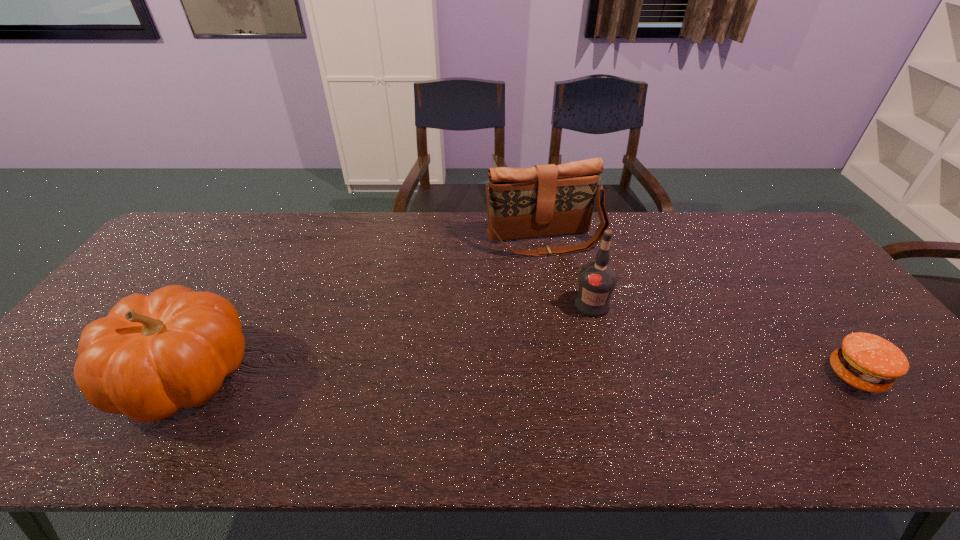
Identify the location of vacant space located 0.220m on the front label of the second farthest object. The image size is (960, 540). (624, 387).

Where is `free spot located on the front label of the second farthest object`? The width and height of the screenshot is (960, 540). free spot located on the front label of the second farthest object is located at coordinates (624, 387).

Find the location of a particular element. This screenshot has width=960, height=540. blank space located on the front label of the second farthest object is located at coordinates (623, 383).

I want to click on object present at the far edge, so click(546, 200).

Locate an element on the screen. The image size is (960, 540). pumpkin that is at the near edge is located at coordinates (153, 355).

Locate an element on the screen. patty present at the near edge is located at coordinates (868, 362).

At what (x,y) coordinates should I click in order to perform the action: click on object that is at the right edge. Please return your answer as a coordinate pair (x, y). The image size is (960, 540). Looking at the image, I should click on (868, 362).

The image size is (960, 540). Find the location of `object that is at the near right corner`. object that is at the near right corner is located at coordinates (868, 362).

Find the location of `blank space at the far edge`. blank space at the far edge is located at coordinates (703, 229).

You are a GUI agent. You are given a task and a screenshot of the screen. Output one action in this format:
    pyautogui.click(x=<x>, y=<y>)
    Task: Click on the vacant space at the near edge of the desktop
    Image resolution: width=960 pixels, height=540 pixels.
    Given the screenshot: What is the action you would take?
    pyautogui.click(x=430, y=406)